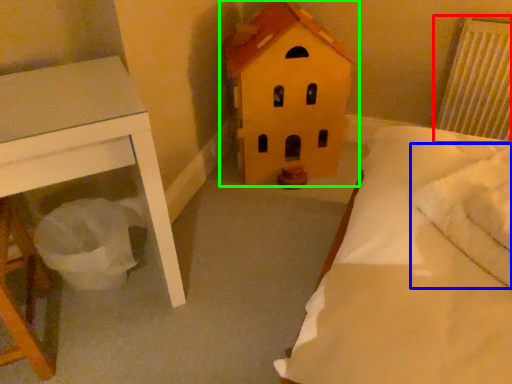
Question: Based on their relative distances, which object is nearer to radiator (highlighted by a red box)? Choose from pillow (highlighted by a blue box) and toy (highlighted by a green box).

Choices:
 (A) pillow
 (B) toy

Answer: (B)